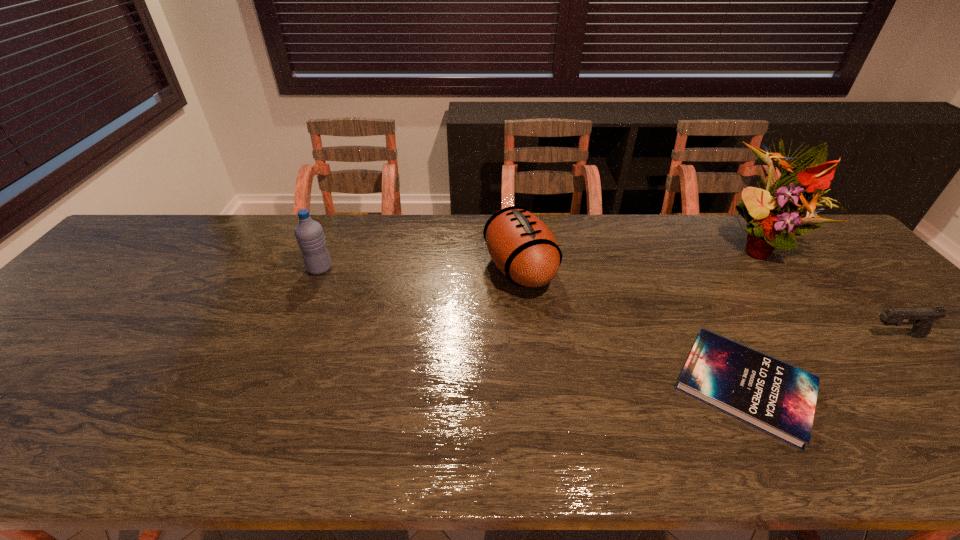
The height and width of the screenshot is (540, 960). I want to click on vacant area located 0.270m at the barrel of the pistol, so click(x=757, y=335).

Where is `blank space located at the barrel of the pistol`? blank space located at the barrel of the pistol is located at coordinates (778, 335).

The image size is (960, 540). In order to click on vacant region located 0.290m on the right of the shortest object in this screenshot , I will do `click(948, 386)`.

Find the location of `bouquet located at the far edge`. bouquet located at the far edge is located at coordinates (772, 215).

Locate an element on the screen. Image resolution: width=960 pixels, height=540 pixels. football (American) present at the far edge is located at coordinates (523, 248).

The height and width of the screenshot is (540, 960). Find the location of `object that is positioned at the near edge`. object that is positioned at the near edge is located at coordinates (773, 396).

Identify the location of bouquet at the right edge. (772, 215).

The image size is (960, 540). In order to click on pistol that is positioned at the right edge in this screenshot , I will do `click(921, 318)`.

The height and width of the screenshot is (540, 960). I want to click on object that is at the far right corner, so click(x=772, y=215).

In the image, there is a desktop. In order to click on vacant space at the far edge in this screenshot , I will do (324, 235).